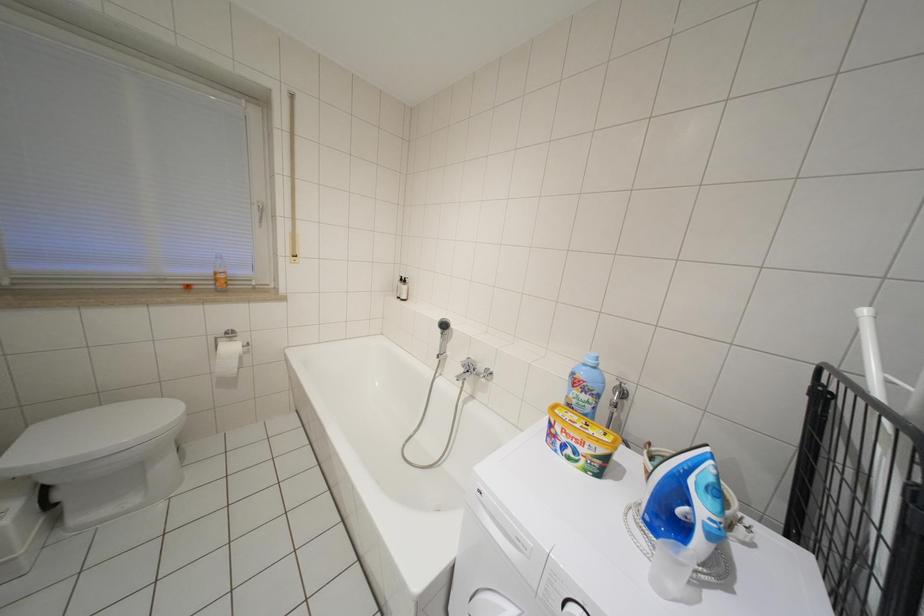
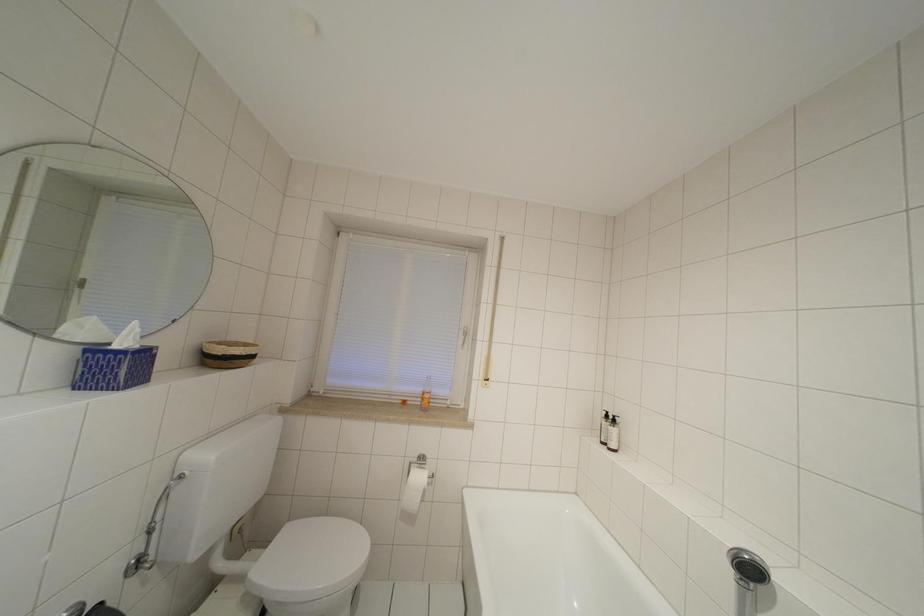
The first image is from the beginning of the video and the second image is from the end. How did the camera likely rotate when shooting the video?

The rotation direction of the camera is left-up.